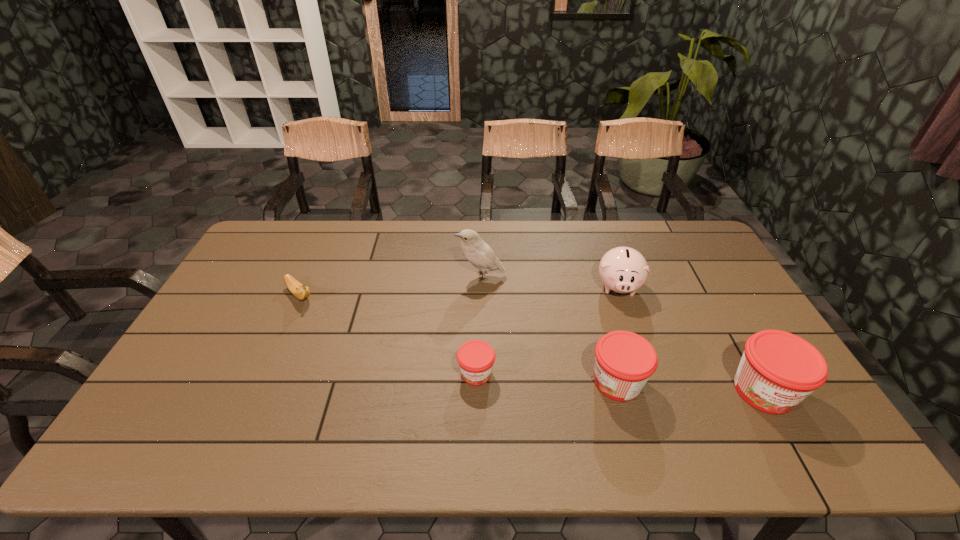
Identify the location of the shortest jam. The image size is (960, 540). (475, 358).

I want to click on the third shortest object, so click(624, 361).

What are the coordinates of `the second jam from right to left` in the screenshot? It's located at (624, 361).

Locate an element on the screen. This screenshot has width=960, height=540. the rightmost jam is located at coordinates (778, 370).

This screenshot has width=960, height=540. In order to click on the leftmost object in this screenshot , I will do `click(300, 291)`.

Locate an element on the screen. The width and height of the screenshot is (960, 540). piggy bank is located at coordinates (622, 269).

Where is `bird`? bird is located at coordinates (477, 252).

Identify the location of vacant space located on the label side of the second jam from left to right. The height and width of the screenshot is (540, 960). (462, 382).

Where is `free spot located 0.060m on the label side of the second jam from left to right`? The height and width of the screenshot is (540, 960). free spot located 0.060m on the label side of the second jam from left to right is located at coordinates (565, 382).

This screenshot has width=960, height=540. I want to click on free spot located on the label side of the second jam from left to right, so click(489, 382).